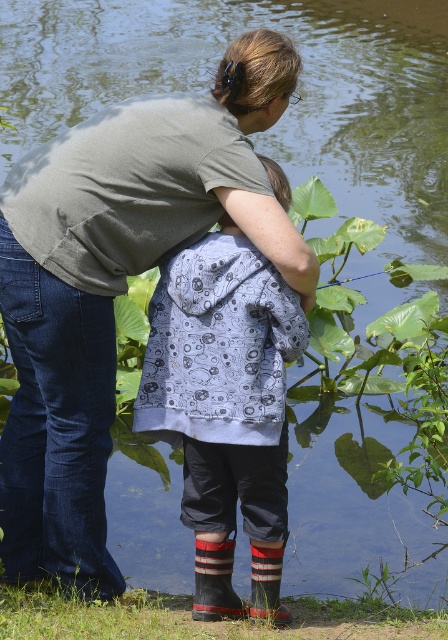
Question: Which of the following is the closest to the observer?

Choices:
 (A) (275, 518)
 (B) (266, 586)

Answer: (A)

Question: Is patterned fabric hoodie at center positioned before striped wool socks at lower center?

Choices:
 (A) yes
 (B) no

Answer: (A)

Question: Can you confirm if patterned fabric hoodie at center is bigger than striped wool socks at lower center?

Choices:
 (A) yes
 (B) no

Answer: (A)

Question: Is the position of patterned fabric hoodie at center less distant than that of striped wool socks at lower center?

Choices:
 (A) no
 (B) yes

Answer: (B)